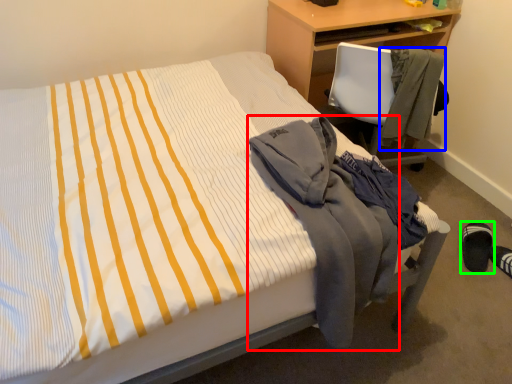
Question: Which is farther away from jacket (highlighted by a red box)? jacket (highlighted by a blue box) or footwear (highlighted by a green box)?

Choices:
 (A) jacket
 (B) footwear

Answer: (B)